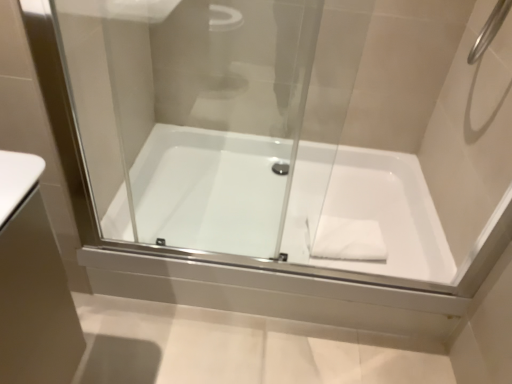
Question: Is white glossy bathtub at center facing towards white matte hand towel at center?

Choices:
 (A) yes
 (B) no

Answer: (A)

Question: Considering the relative sizes of white glossy bathtub at center and white matte hand towel at center in the image provided, is white glossy bathtub at center shorter than white matte hand towel at center?

Choices:
 (A) yes
 (B) no

Answer: (B)

Question: Can you confirm if white glossy bathtub at center is positioned to the left of white matte hand towel at center?

Choices:
 (A) no
 (B) yes

Answer: (B)

Question: From a real-world perspective, is white glossy bathtub at center physically below white matte hand towel at center?

Choices:
 (A) yes
 (B) no

Answer: (A)

Question: Does white glossy bathtub at center lie in front of white matte hand towel at center?

Choices:
 (A) yes
 (B) no

Answer: (A)

Question: Does white glossy bathtub at center come behind white matte hand towel at center?

Choices:
 (A) no
 (B) yes

Answer: (A)

Question: From the image's perspective, is white glossy bathtub at center over transparent glass door at center?

Choices:
 (A) no
 (B) yes

Answer: (A)

Question: Could you tell me if white glossy bathtub at center is facing transparent glass door at center?

Choices:
 (A) no
 (B) yes

Answer: (A)

Question: From the image's perspective, would you say white glossy bathtub at center is shown under transparent glass door at center?

Choices:
 (A) yes
 (B) no

Answer: (A)

Question: From a real-world perspective, is white glossy bathtub at center positioned over transparent glass door at center based on gravity?

Choices:
 (A) yes
 (B) no

Answer: (B)

Question: Would you consider white glossy bathtub at center to be distant from transparent glass door at center?

Choices:
 (A) yes
 (B) no

Answer: (B)

Question: Is white glossy bathtub at center positioned behind transparent glass door at center?

Choices:
 (A) yes
 (B) no

Answer: (A)

Question: Is transparent glass door at center completely or partially outside of white glossy bathtub at center?

Choices:
 (A) yes
 (B) no

Answer: (A)